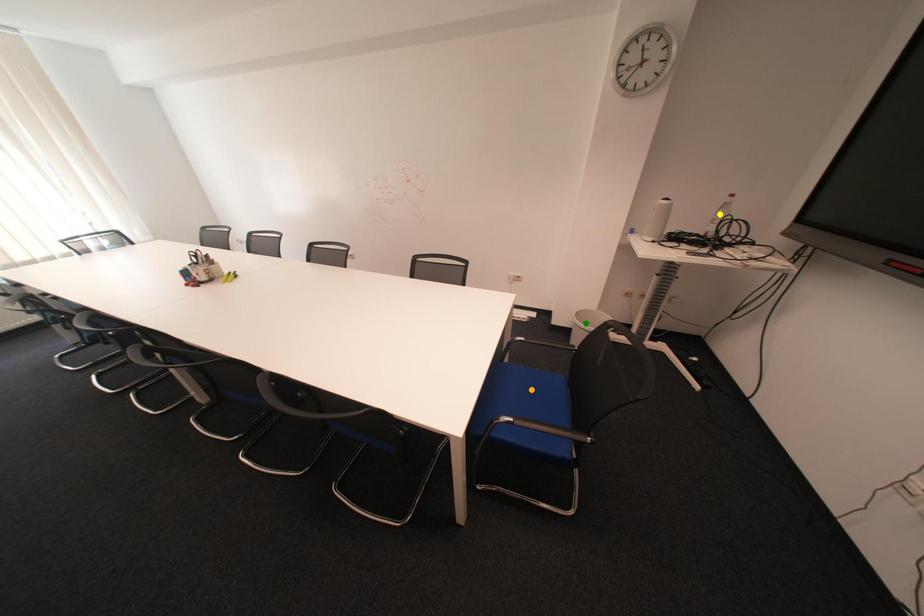
Order these from nearest to farthest:
A) yellow point
B) orange point
C) green point

green point
orange point
yellow point